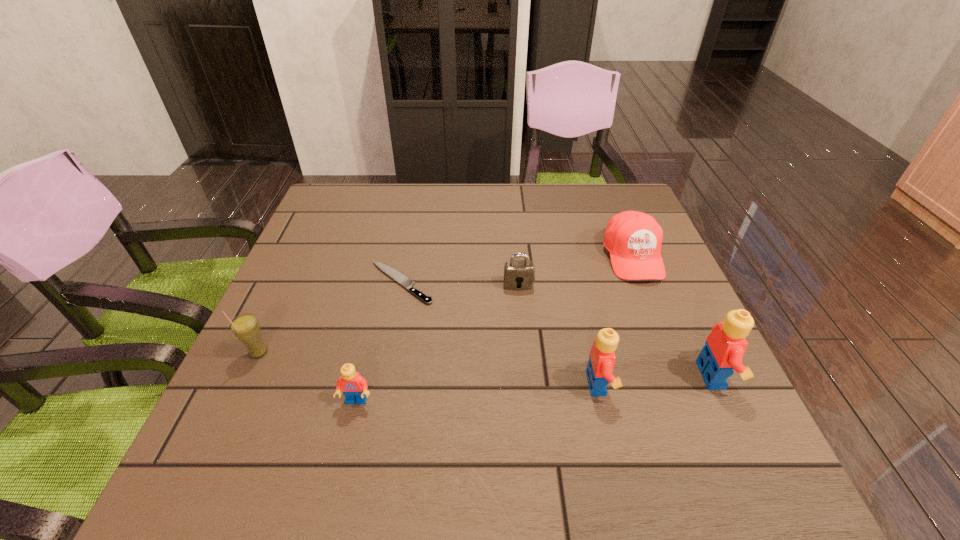
Locate an element on the screen. The height and width of the screenshot is (540, 960). vacant space located on the right of the straw for drinking is located at coordinates (344, 353).

You are a GUI agent. You are given a task and a screenshot of the screen. Output one action in this format:
    pyautogui.click(x=<x>, y=<y>)
    Task: Click on the free spot located on the back of the shortest object
    The height and width of the screenshot is (540, 960).
    Given the screenshot: What is the action you would take?
    pyautogui.click(x=417, y=204)

Where is `vacant space situated at the front of the fourth object from right to left near the keyhole`? This screenshot has width=960, height=540. vacant space situated at the front of the fourth object from right to left near the keyhole is located at coordinates (525, 363).

The image size is (960, 540). Find the location of `object at the left edge`. object at the left edge is located at coordinates (246, 328).

What are the coordinates of `Lego that is at the right edge` in the screenshot? It's located at (725, 346).

Locate an element on the screen. The width and height of the screenshot is (960, 540). baseball cap situated at the right edge is located at coordinates (633, 239).

Find the location of a particular element. object that is at the near right corner is located at coordinates (725, 346).

The height and width of the screenshot is (540, 960). In the image, there is a desktop. What are the coordinates of `vacant space at the far edge` in the screenshot? It's located at (447, 195).

Locate an element on the screen. The width and height of the screenshot is (960, 540). free spot at the near edge of the desktop is located at coordinates (492, 400).

Locate an element on the screen. The height and width of the screenshot is (540, 960). free spot at the left edge of the desktop is located at coordinates [293, 345].